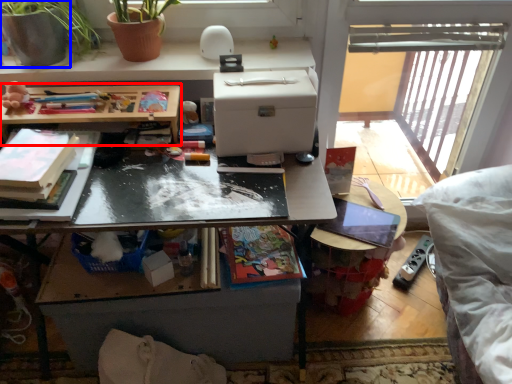
Question: Among these objects, which one is nearest to the camera, table (highlighted by a red box) or flowerpot (highlighted by a blue box)?

Choices:
 (A) table
 (B) flowerpot

Answer: (A)